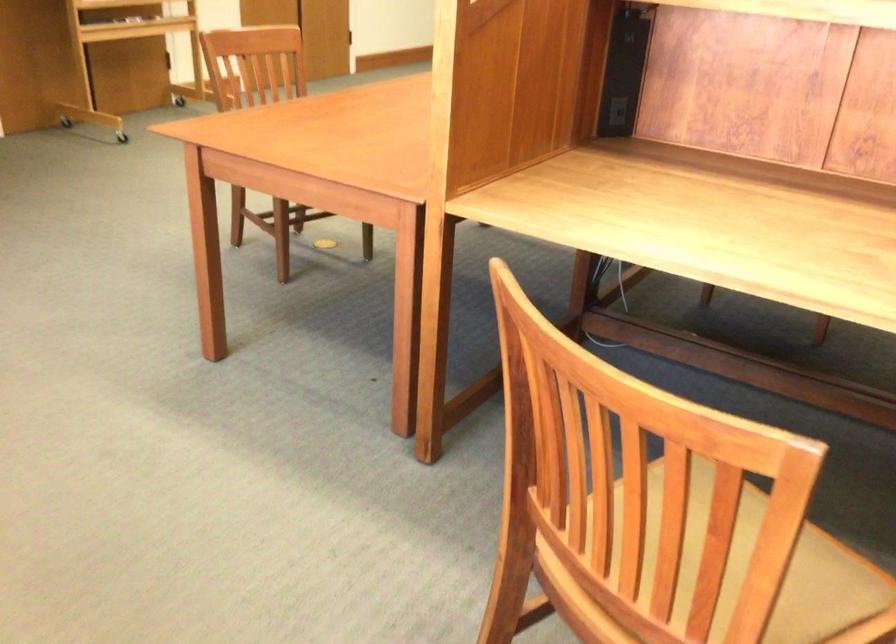
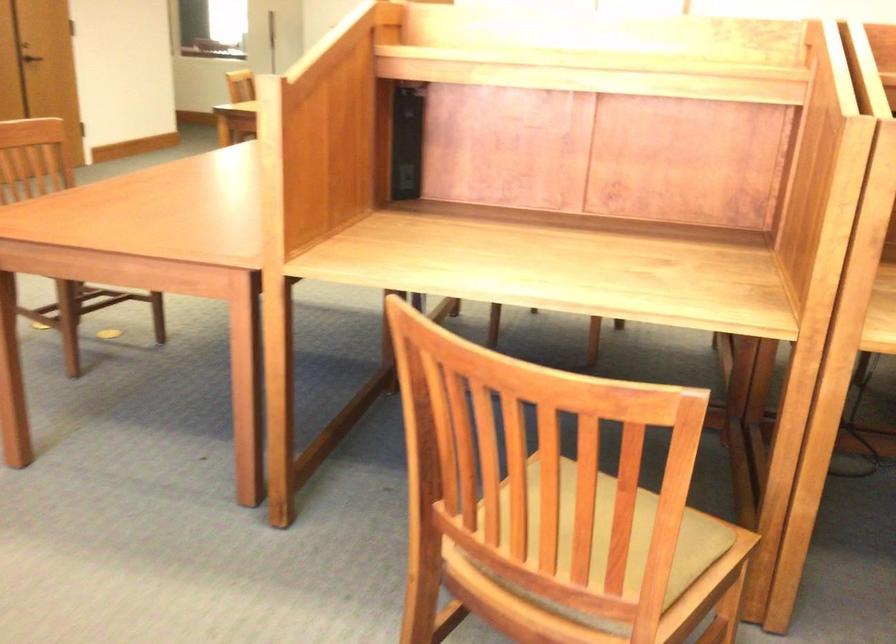
Question: The images are taken continuously from a first-person perspective. In which direction is your viewpoint rotating?

Choices:
 (A) Left
 (B) Right
 (C) Up
 (D) Down

Answer: (B)